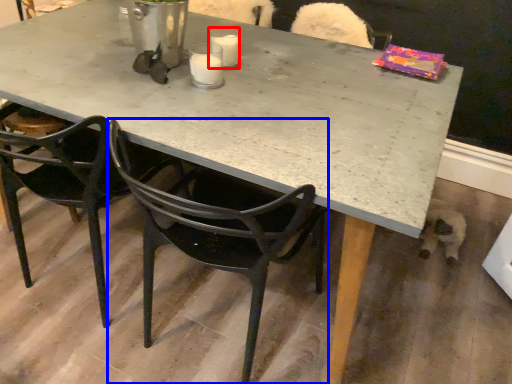
Question: Which object appears farthest to the camera in this image, coffee cup (highlighted by a red box) or chair (highlighted by a blue box)?

Choices:
 (A) coffee cup
 (B) chair

Answer: (A)